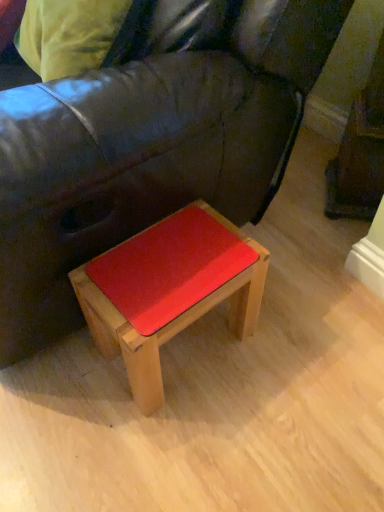
Question: From a real-world perspective, is wooden stool at lower center below leather couch at center?

Choices:
 (A) no
 (B) yes

Answer: (B)

Question: Is wooden stool at lower center taller than leather couch at center?

Choices:
 (A) no
 (B) yes

Answer: (A)

Question: Is wooden stool at lower center wider than leather couch at center?

Choices:
 (A) no
 (B) yes

Answer: (A)

Question: From the image's perspective, is wooden stool at lower center located above leather couch at center?

Choices:
 (A) yes
 (B) no

Answer: (B)

Question: Considering the relative positions of wooden stool at lower center and leather couch at center in the image provided, is wooden stool at lower center in front of leather couch at center?

Choices:
 (A) no
 (B) yes

Answer: (A)

Question: Is wooden stool at lower center smaller than leather couch at center?

Choices:
 (A) yes
 (B) no

Answer: (A)

Question: From the image's perspective, is leather couch at center under wooden stool at lower center?

Choices:
 (A) no
 (B) yes

Answer: (A)

Question: Is leather couch at center positioned beyond the bounds of wooden stool at lower center?

Choices:
 (A) no
 (B) yes

Answer: (B)

Question: Could wooden stool at lower center be considered to be inside leather couch at center?

Choices:
 (A) no
 (B) yes

Answer: (A)

Question: Considering the relative sizes of leather couch at center and wooden stool at lower center in the image provided, is leather couch at center shorter than wooden stool at lower center?

Choices:
 (A) no
 (B) yes

Answer: (A)

Question: From the image's perspective, would you say leather couch at center is positioned over wooden stool at lower center?

Choices:
 (A) yes
 (B) no

Answer: (A)

Question: Is the position of leather couch at center more distant than that of wooden stool at lower center?

Choices:
 (A) yes
 (B) no

Answer: (B)

Question: Is point (153, 232) closer or farther from the camera than point (36, 210)?

Choices:
 (A) closer
 (B) farther

Answer: (B)